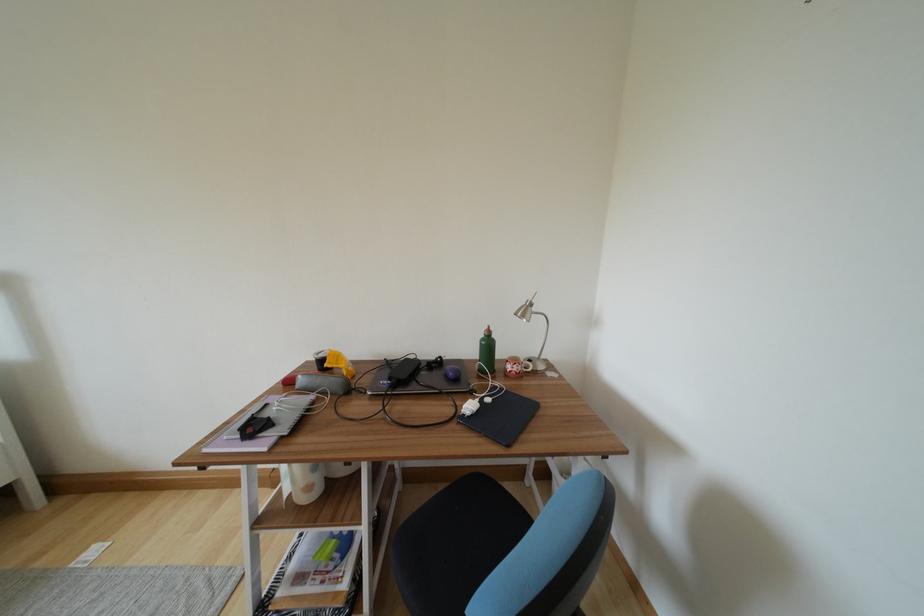
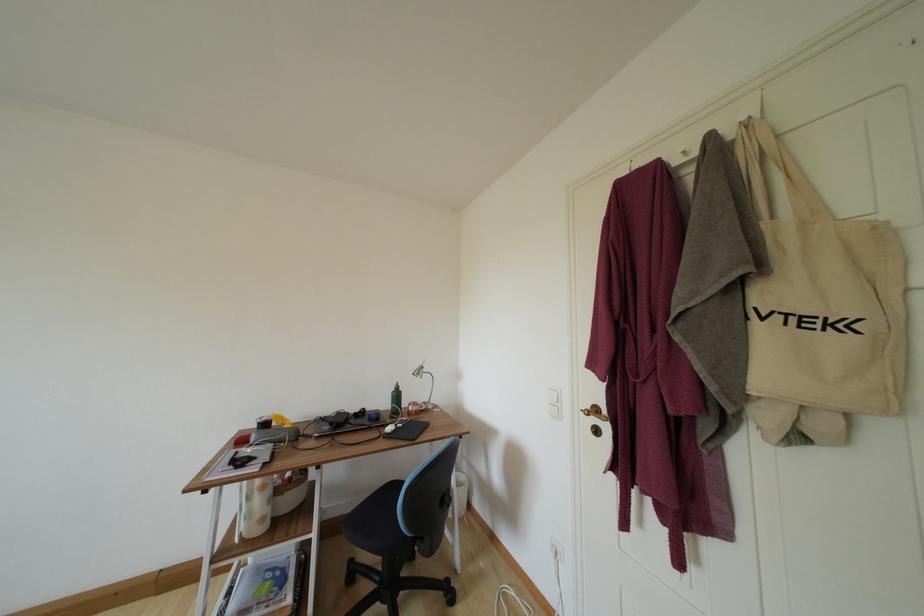
The point at (442,368) is marked in the first image. Where is the corresponding point in the second image?

(367, 416)